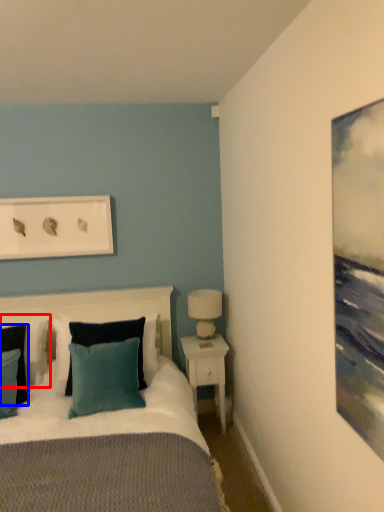
Question: Which of the following is the farthest to the observer, pillow (highlighted by a red box) or pillow (highlighted by a blue box)?

Choices:
 (A) pillow
 (B) pillow

Answer: (A)